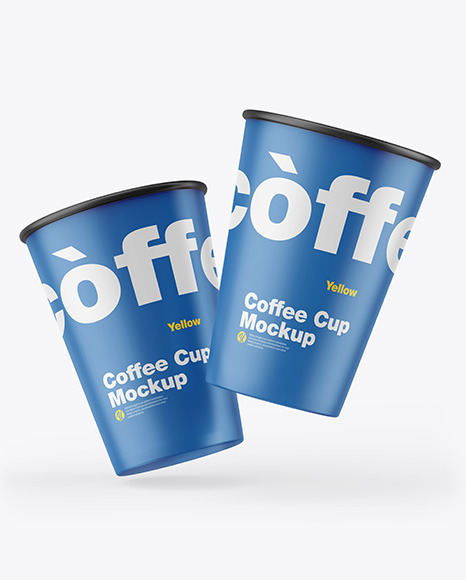
At what (x,y) coordinates should I click in order to perform the action: click on black rim around coffee cup. Please return your answer as a coordinate pair (x, y). The height and width of the screenshot is (580, 466). Looking at the image, I should click on (129, 192), (344, 134).